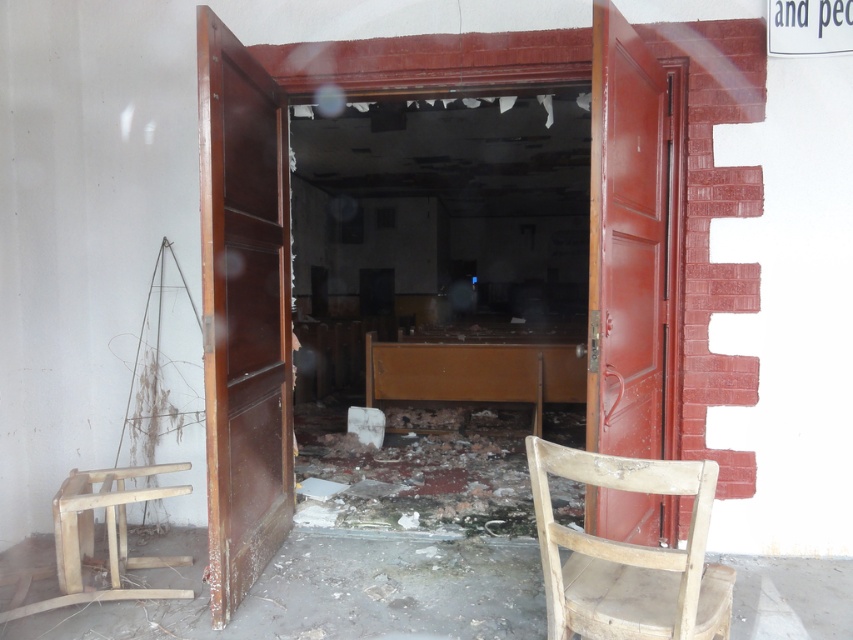
You are standing at the doorway of the abandoned building and see two points marked on the floor. The first point is at coordinate point (264, 404) and the second is at point (590, 403). Which point is closer to you?

Point (590, 403) is closer to you because it is in front of point (264, 404), which is behind it.

You are standing outside the building and want to enter through the door. Which door should you use to enter the room, the mahogany wood door at center or the smooth glossy wood door at right?

The mahogany wood door at center is below the smooth glossy wood door at right, so the mahogany wood door at center is the one at the center and lower position, which is likely the main entrance. Use the mahogany wood door at center to enter the room.

You are a maintenance worker needing to clear a path from the doorway to the wooden desk at the far end. You see a wooden chair at lower right and a wooden stool at lower left. Which object should you move first to start clearing the path?

You should move the wooden stool at lower left first because it is positioned to the left of the wooden chair at lower right, making it closer to the doorway and the starting point of the path.